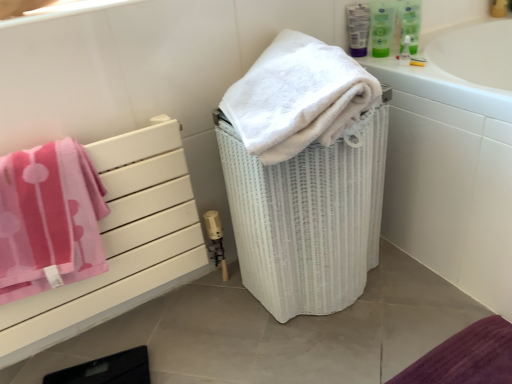
The width and height of the screenshot is (512, 384). Find the location of `vacant area that lies between pink fabric towel at left and white wicker laundry basket at center`. vacant area that lies between pink fabric towel at left and white wicker laundry basket at center is located at coordinates (202, 326).